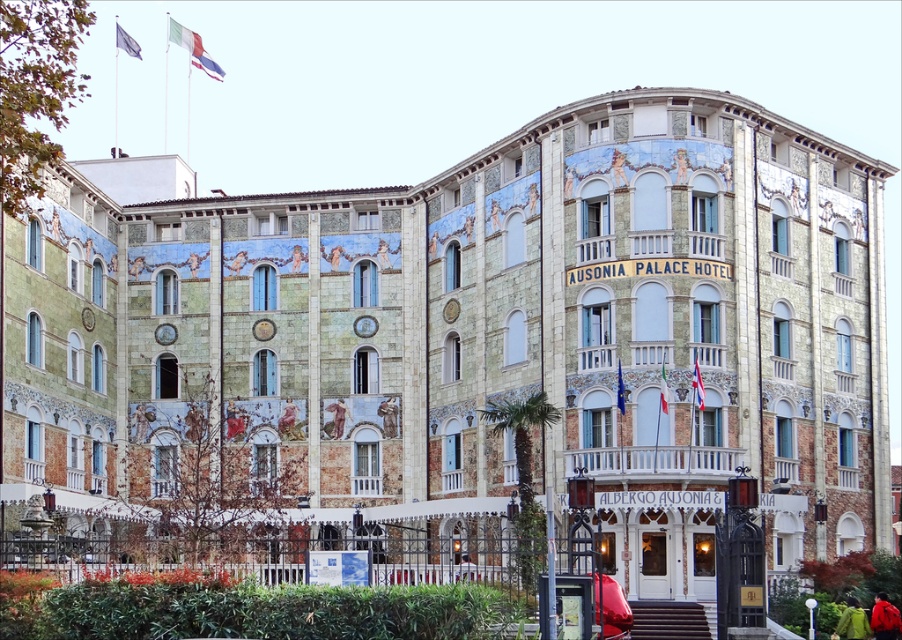
Question: Can you confirm if red jacket at center is thinner than red jacket at lower center?

Choices:
 (A) no
 (B) yes

Answer: (A)

Question: Which point is farther to the camera?

Choices:
 (A) red jacket at center
 (B) red jacket at lower center

Answer: (B)

Question: Does brown textured fabric at center appear on the right side of red jacket at lower center?

Choices:
 (A) no
 (B) yes

Answer: (A)

Question: Which object is positioned closest to the red jacket at lower center?

Choices:
 (A) brown textured fabric at center
 (B) red jacket at center

Answer: (B)

Question: Which point appears farthest from the camera in this image?

Choices:
 (A) (470, 576)
 (B) (873, 627)
 (C) (859, 620)
 (D) (293, 406)

Answer: (D)

Question: Is light brown wooden chair at center to the right of red jacket at lower center from the viewer's perspective?

Choices:
 (A) yes
 (B) no

Answer: (B)